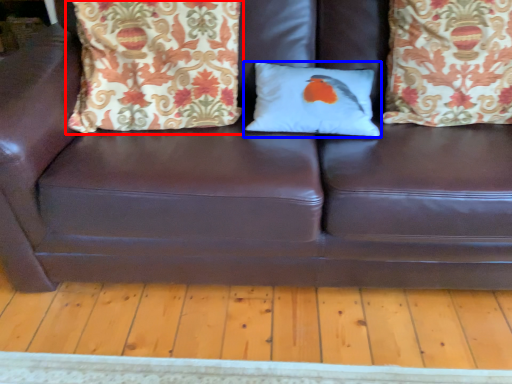
Question: Which point is closer to the camera, pillow (highlighted by a red box) or pillow (highlighted by a blue box)?

Choices:
 (A) pillow
 (B) pillow

Answer: (A)